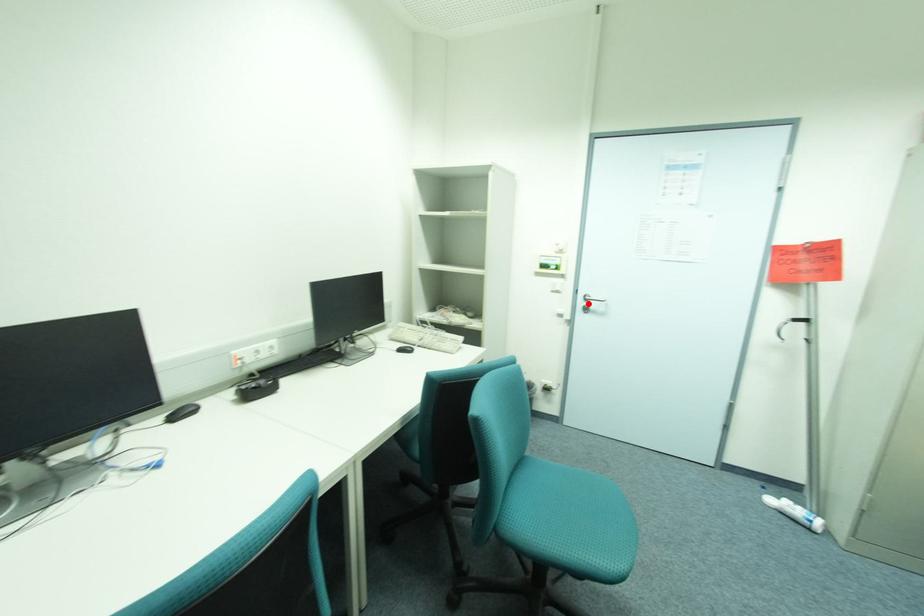
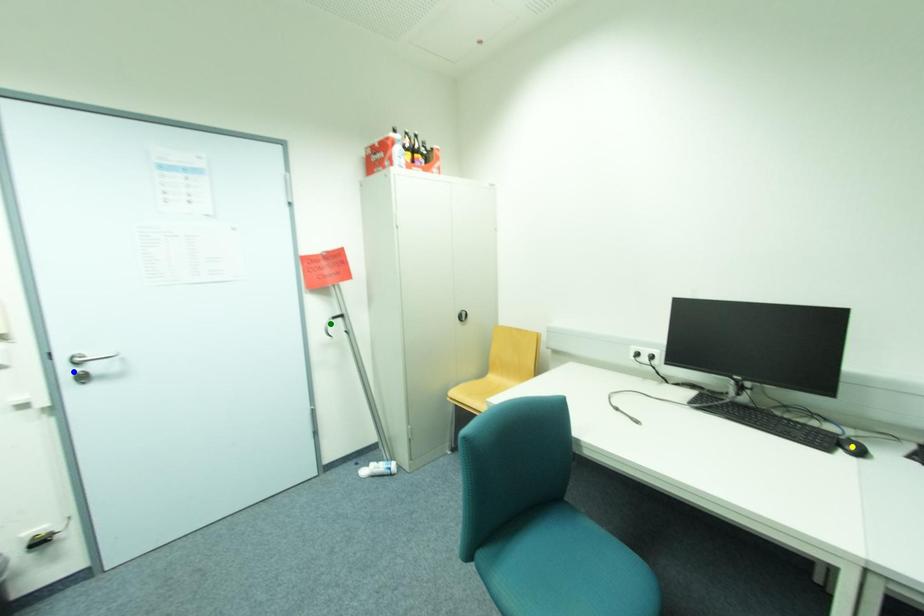
Question: I am providing you with two images of the same scene from different viewpoints. A red point is marked on the first image. You are given multiple points on the second image. In image 2, which mark is for the same physical point as the one in image 1?

Choices:
 (A) green point
 (B) blue point
 (C) yellow point

Answer: (B)